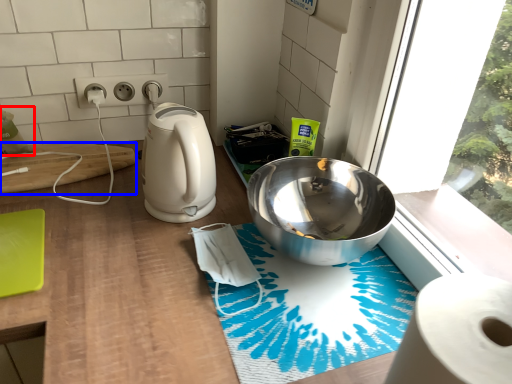
Question: Among these objects, which one is nearest to the camera, toilet paper (highlighted by a red box) or cutting board (highlighted by a blue box)?

Choices:
 (A) toilet paper
 (B) cutting board

Answer: (A)